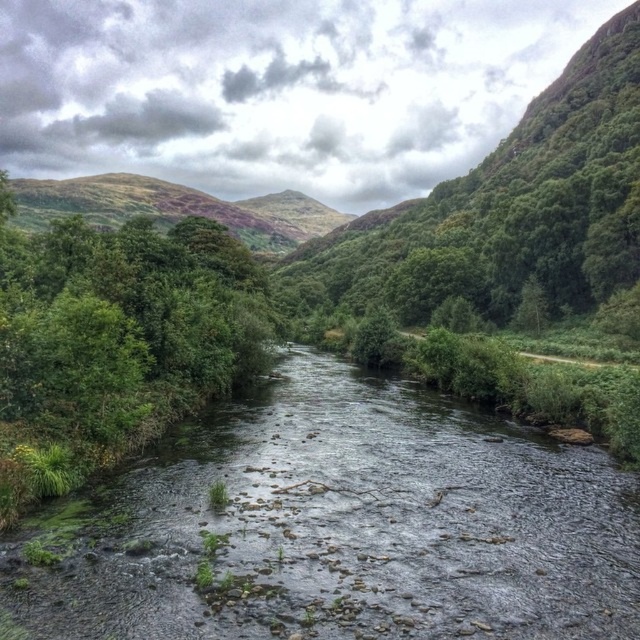
You are standing at the edge of the river and notice clear water at center and green mossy hillside at center. Which object is positioned to the right of the other?

The clear water at center is to the right of green mossy hillside at center.

You are an explorer trying to cross the river. You see the clear water at center and the green mossy hillside at center. Which path is narrower between the two?

The clear water at center is thinner than the green mossy hillside at center, so the clear water at center is the narrower path between the two.

You are standing at the point marked as point (340, 525) in the image. What is the nearest object to you in the scene?

The clear water at center is located at point (340, 525), so you are standing in the clear water at center.